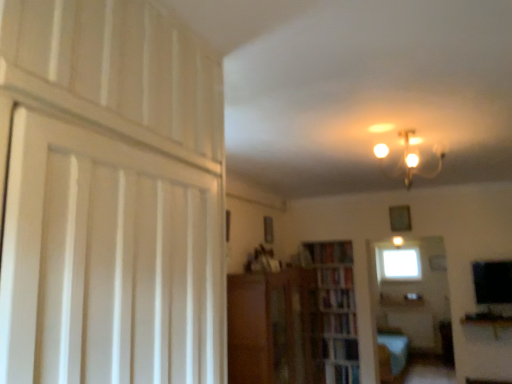
Question: Would you consider hardcover book at center, which ranks as the 2th book in bottom-to-top order, to be distant from wooden bookcase at center?

Choices:
 (A) yes
 (B) no

Answer: (B)

Question: From the image's perspective, is hardcover book at center, which ranks as the 2th book in bottom-to-top order, located above wooden bookcase at center?

Choices:
 (A) no
 (B) yes

Answer: (B)

Question: Does hardcover book at center, acting as the 3th book starting from the top, appear on the left side of wooden bookcase at center?

Choices:
 (A) no
 (B) yes

Answer: (A)

Question: Is wooden bookcase at center a part of hardcover book at center, acting as the 3th book starting from the top?

Choices:
 (A) no
 (B) yes

Answer: (A)

Question: Considering the relative sizes of hardcover book at center, acting as the 3th book starting from the top, and wooden bookcase at center in the image provided, is hardcover book at center, acting as the 3th book starting from the top, shorter than wooden bookcase at center?

Choices:
 (A) yes
 (B) no

Answer: (A)

Question: Does hardcover book at center, which ranks as the 2th book in bottom-to-top order, appear on the right side of wooden bookcase at center?

Choices:
 (A) no
 (B) yes

Answer: (B)

Question: Is there a large distance between transparent glass window at center and matte glass chandelier at upper center?

Choices:
 (A) no
 (B) yes

Answer: (B)

Question: From the image's perspective, is transparent glass window at center below matte glass chandelier at upper center?

Choices:
 (A) no
 (B) yes

Answer: (B)

Question: Could you tell me if transparent glass window at center is turned towards matte glass chandelier at upper center?

Choices:
 (A) yes
 (B) no

Answer: (A)

Question: Is transparent glass window at center smaller than matte glass chandelier at upper center?

Choices:
 (A) no
 (B) yes

Answer: (A)

Question: Does transparent glass window at center come behind matte glass chandelier at upper center?

Choices:
 (A) yes
 (B) no

Answer: (A)

Question: From a real-world perspective, is transparent glass window at center physically above matte glass chandelier at upper center?

Choices:
 (A) no
 (B) yes

Answer: (A)

Question: From the image's perspective, is wooden bookshelf at center on top of transparent glass window at center?

Choices:
 (A) no
 (B) yes

Answer: (A)